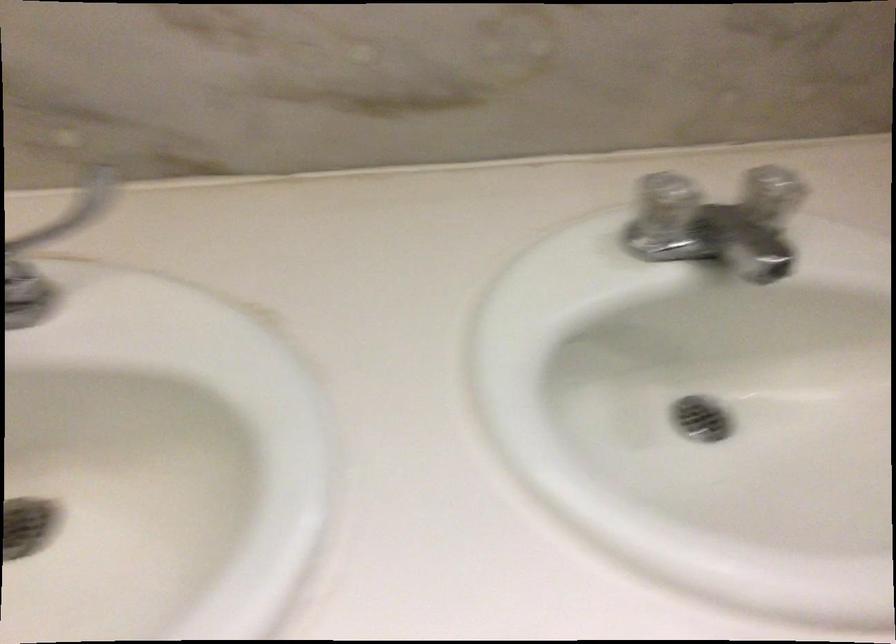
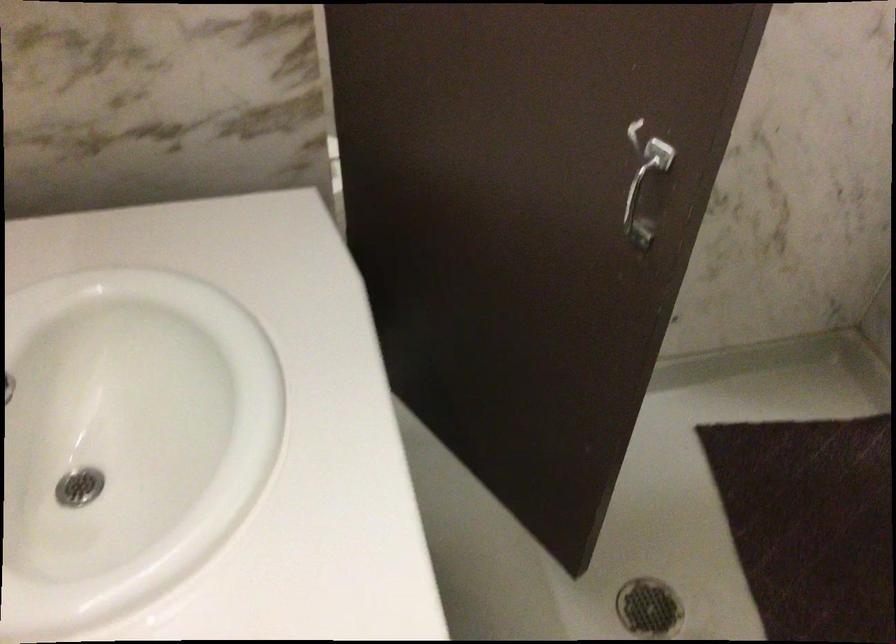
The first image is from the beginning of the video and the second image is from the end. How did the camera likely rotate when shooting the video?

The rotation direction of the camera is right-down.